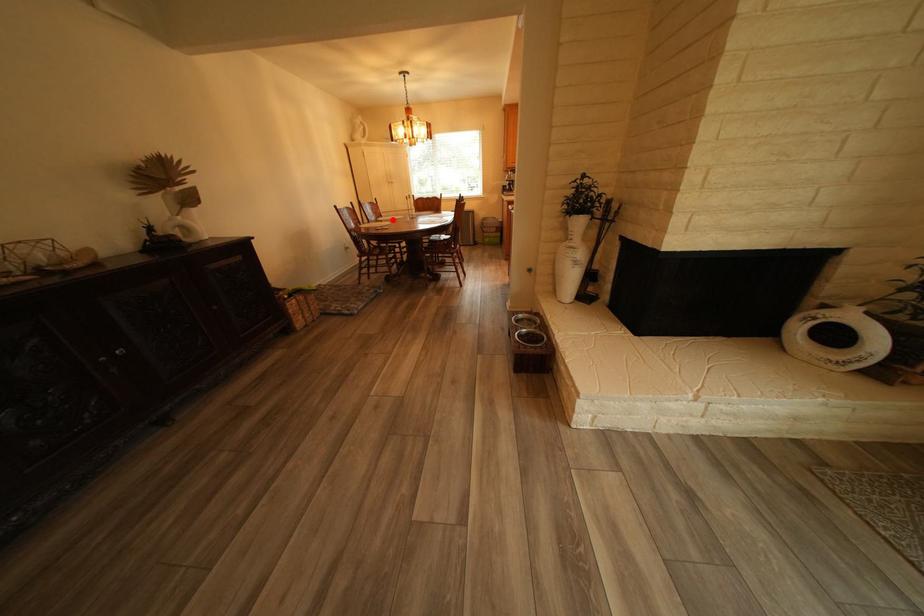
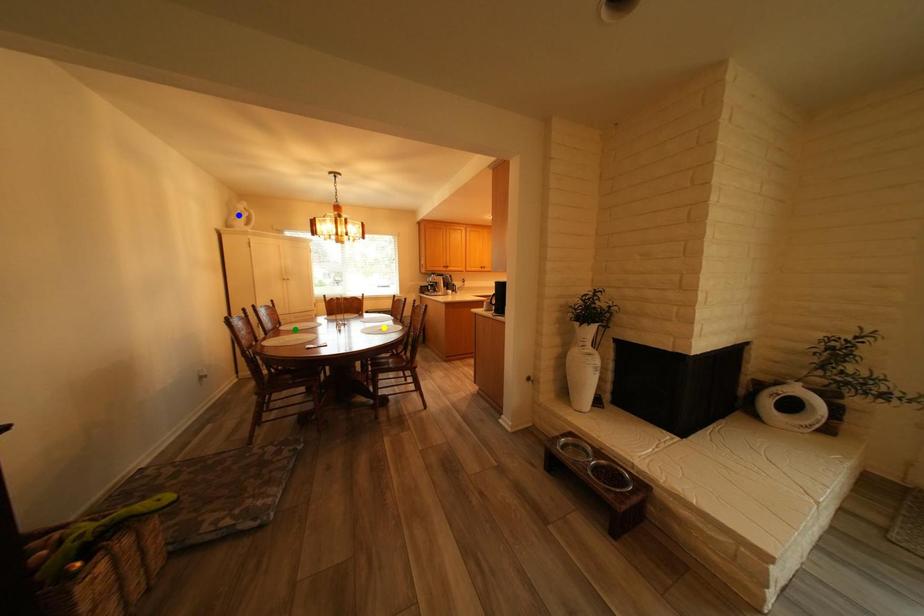
Question: I am providing you with two images of the same scene from different viewpoints. A red point is marked on the first image. You are given multiple points on the second image. Which mark in image 2 goes with the point in image 1?

Choices:
 (A) blue point
 (B) green point
 (C) yellow point

Answer: (B)